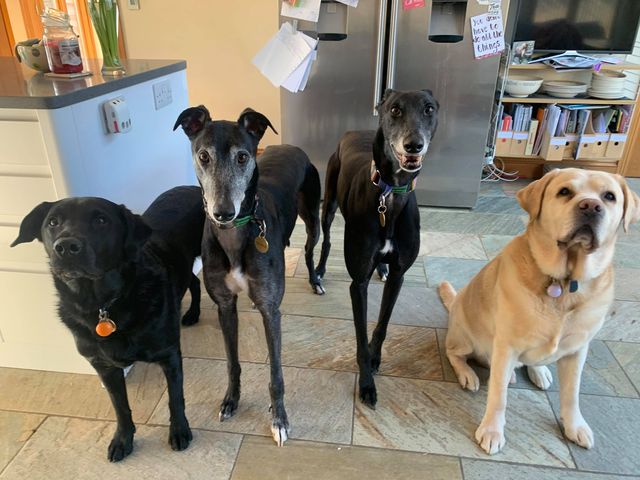
Find the location of a particular element. The image size is (640, 480). papers is located at coordinates (299, 63), (488, 41), (310, 9).